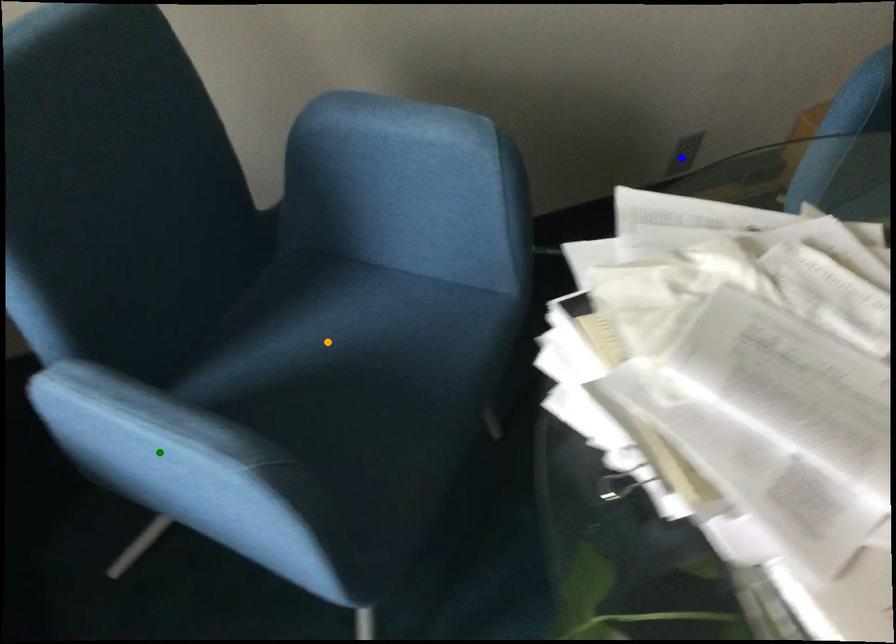
Order these from nearest to farthest:
1. blue point
2. orange point
3. green point

green point → orange point → blue point